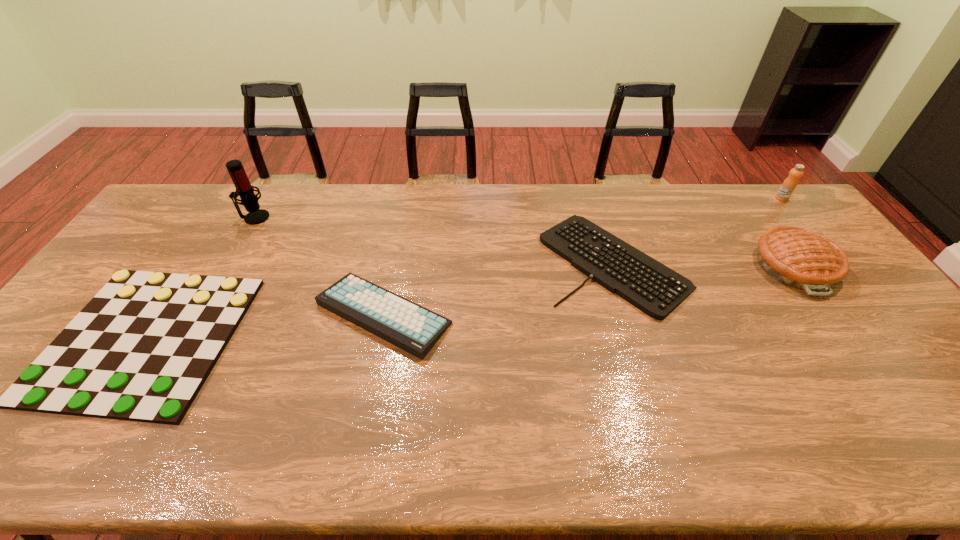
At what (x,y) coordinates should I click in order to perform the action: click on the third closest object relative to the shorter computer keyboard. Please return your answer as a coordinate pair (x, y). Looking at the image, I should click on (790, 183).

The width and height of the screenshot is (960, 540). Find the location of `object that ranks as the second closest to the third tallest object`. object that ranks as the second closest to the third tallest object is located at coordinates (655, 289).

The width and height of the screenshot is (960, 540). I want to click on free space that satisfies the following two spatial constraints: 1. on the front side of the tallest object; 2. on the left side of the pie, so click(x=228, y=266).